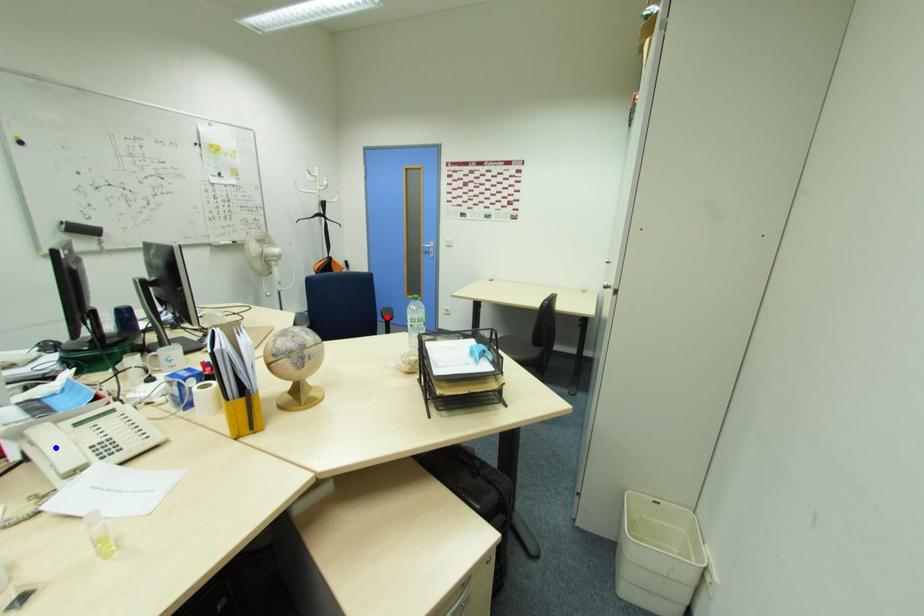
Question: Which of the two points in the image is closer to the camera?

Choices:
 (A) Blue point is closer.
 (B) Red point is closer.

Answer: (A)